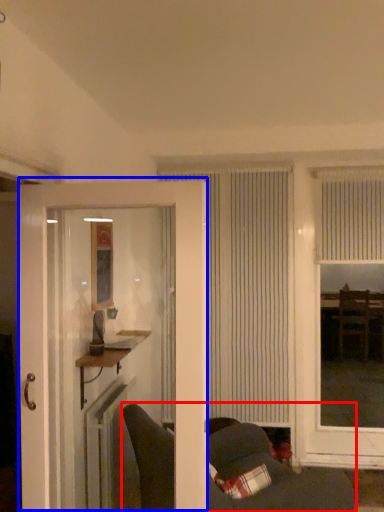
Question: Which object is closer to the camera taking this photo, furniture (highlighted by a red box) or door (highlighted by a blue box)?

Choices:
 (A) furniture
 (B) door

Answer: (B)